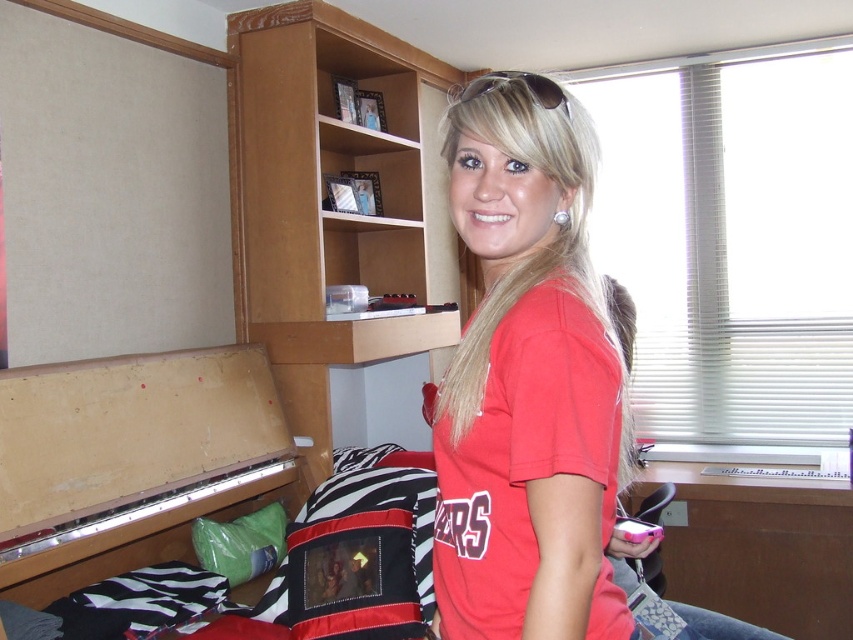
Can you confirm if matte red t-shirt at center is taller than wooden bookshelf at upper center?

In fact, matte red t-shirt at center may be shorter than wooden bookshelf at upper center.

This screenshot has width=853, height=640. What do you see at coordinates (527, 380) in the screenshot?
I see `matte red t-shirt at center` at bounding box center [527, 380].

Who is more distant from viewer, (x=548, y=465) or (x=297, y=392)?

The point (x=297, y=392) is more distant.

What are the coordinates of `matte red t-shirt at center` in the screenshot? It's located at (527, 380).